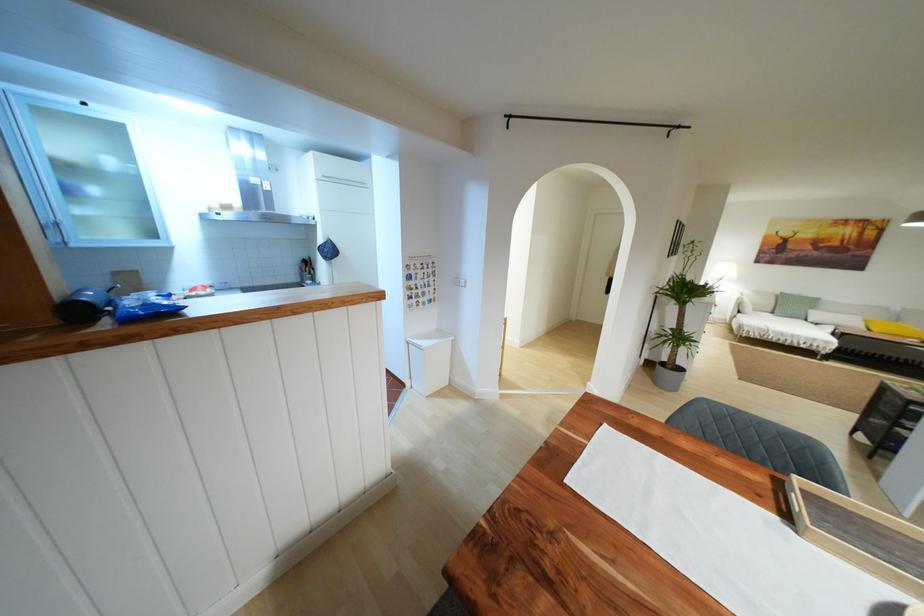
At what (x,y) coordinates should I click in order to perform the action: click on white trash can lid. Please return your answer as a coordinate pair (x, y). The width and height of the screenshot is (924, 616). Looking at the image, I should click on (432, 342).